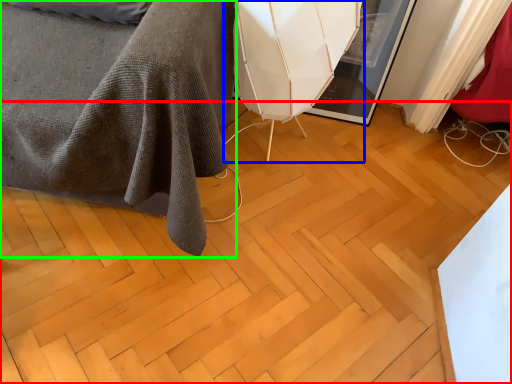
Question: Which object is the closest to the plywood (highlighted by a red box)? Choose among these: swivel chair (highlighted by a blue box) or furniture (highlighted by a green box).

Choices:
 (A) swivel chair
 (B) furniture

Answer: (B)